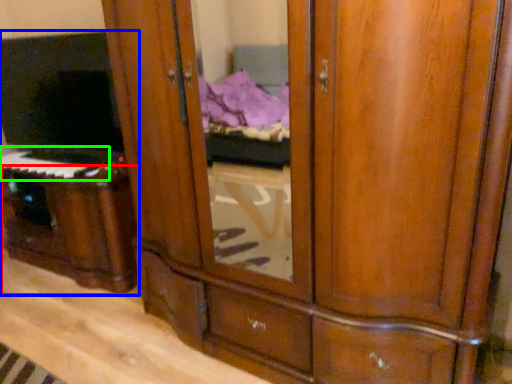
Question: Which is farther away from vanity (highlighted by a red box)? entertainment center (highlighted by a blue box) or musical keyboard (highlighted by a green box)?

Choices:
 (A) entertainment center
 (B) musical keyboard

Answer: (B)